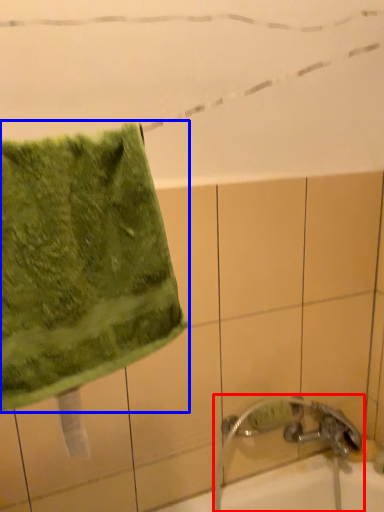
Question: Among these objects, which one is nearest to the camera, faucet (highlighted by a red box) or towel (highlighted by a blue box)?

Choices:
 (A) faucet
 (B) towel

Answer: (B)